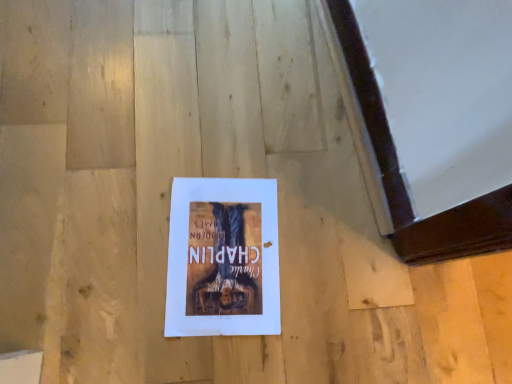
Describe the element at coordinates (223, 258) in the screenshot. I see `white paper at center` at that location.

Locate an element on the screen. white paper at center is located at coordinates (223, 258).

Where is `white paper at center`? white paper at center is located at coordinates (223, 258).